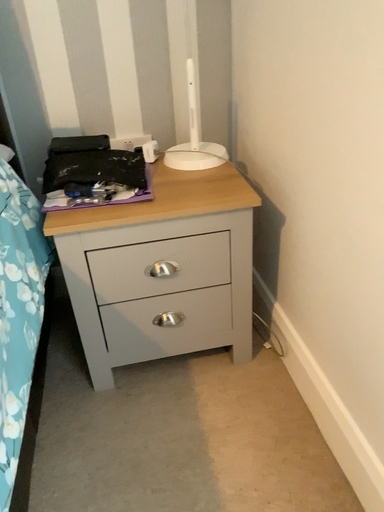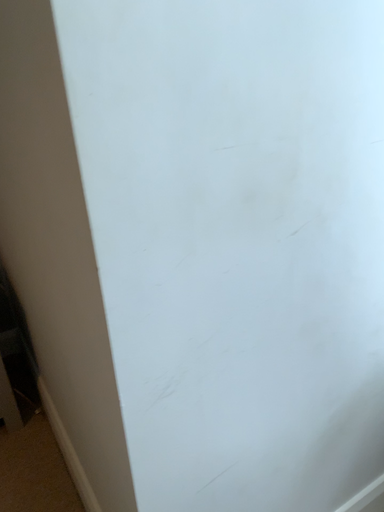
Question: Which way did the camera rotate in the video?

Choices:
 (A) rotated downward
 (B) rotated upward

Answer: (B)